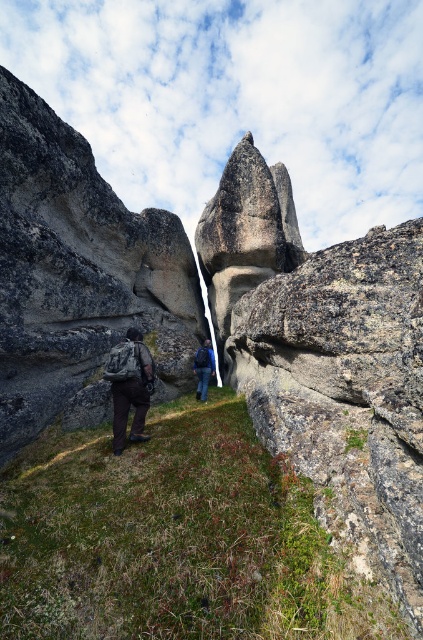
You are a hiker standing at the entrance of the narrow passageway. You notice the rough gray rock formation at center. Based on its position, which direction should you head to reach it?

The rough gray rock formation at center is located at point coordinates, so you should head towards the center of the passageway to reach it.

Looking at this image, you are one of the hikers in the narrow rocky passageway. You need to move your dark gray backpack at center to the right side of the rough gray rock formation at center. Is this possible without moving the rock formation itself?

The rough gray rock formation at center is to the left of the dark gray backpack at center, so moving the backpack to the right of the rock formation would require placing it further to the right than its current position. Since the backpack is already at the center and the rock formation is to its left, this adjustment is possible as long as there is space to the right in the narrow passageway.